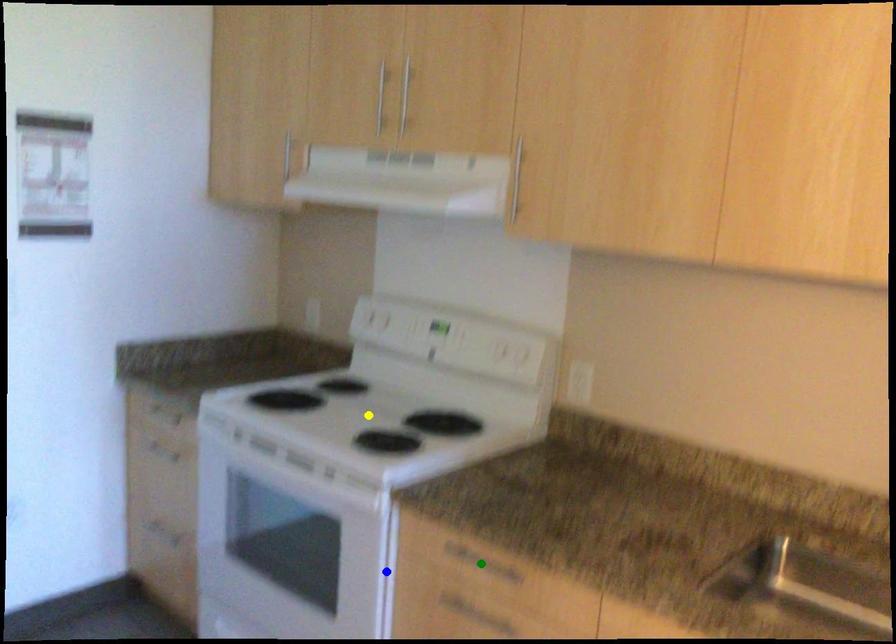
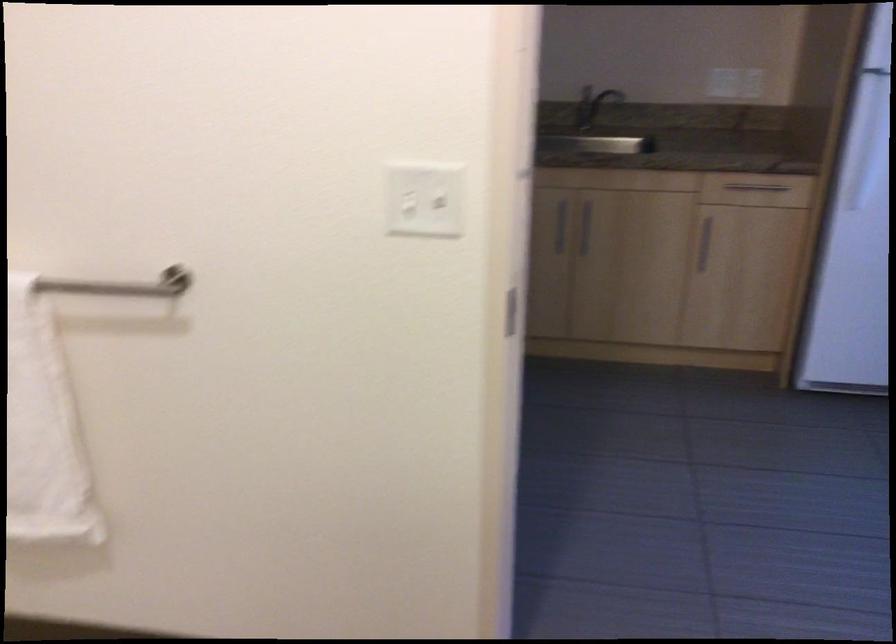
I am providing you with two images of the same scene from different viewpoints. Three points are marked in image1. Which point corresponds to a part or object that is occluded in image2?In image1, three points are marked. Which of them correspond to a part or object that is occluded in image2?Among the three points shown in image1, which one corresponds to a part or object that is no longer visible due to occlusion in image2?

Invisible in image2: green point, blue point, yellow point.